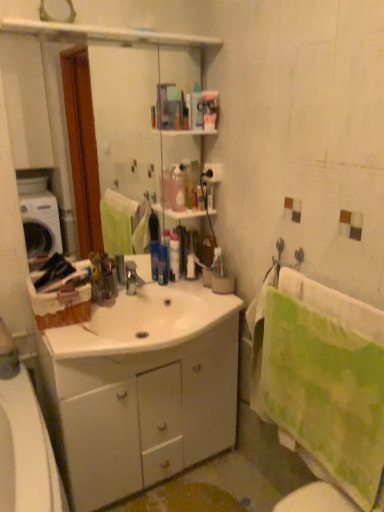
You are a GUI agent. You are given a task and a screenshot of the screen. Output one action in this format:
    pyautogui.click(x=<x>, y=<y>)
    Task: Click on the vacant space in front of blue glossy bottle at center, the 4th toiletry positioned from the right
    Image resolution: width=384 pixels, height=512 pixels.
    Given the screenshot: What is the action you would take?
    pyautogui.click(x=153, y=288)